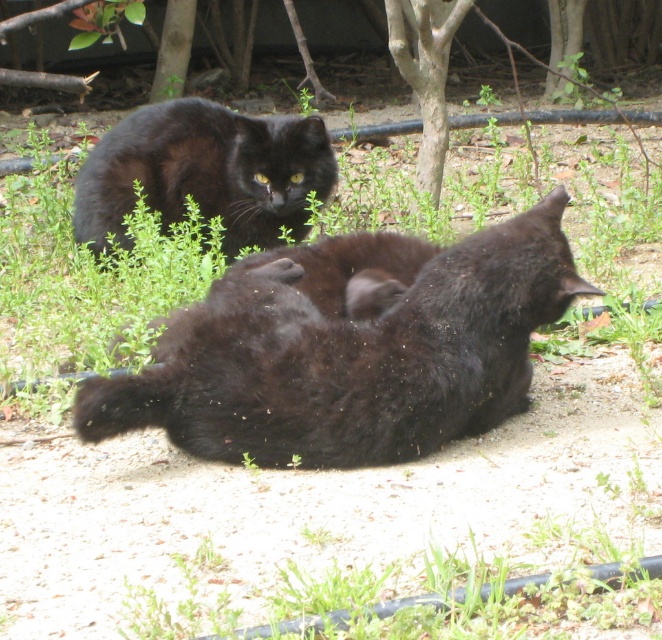
Question: Is black fluffy cat at center positioned in front of shiny black cat at upper left?

Choices:
 (A) no
 (B) yes

Answer: (B)

Question: Does black fluffy cat at center lie in front of shiny black cat at upper left?

Choices:
 (A) yes
 (B) no

Answer: (A)

Question: Which point appears closest to the camera in this image?

Choices:
 (A) (281, 166)
 (B) (230, 316)

Answer: (B)

Question: Is shiny black cat at upper left wider than smooth bark tree at center?

Choices:
 (A) yes
 (B) no

Answer: (A)

Question: Which point is closer to the camera?

Choices:
 (A) black fluffy cat at center
 (B) shiny black cat at upper left

Answer: (A)

Question: Estimate the real-world distances between objects in this image. Which object is farther from the black fluffy cat at center?

Choices:
 (A) smooth bark tree at center
 (B) shiny black cat at upper left

Answer: (A)